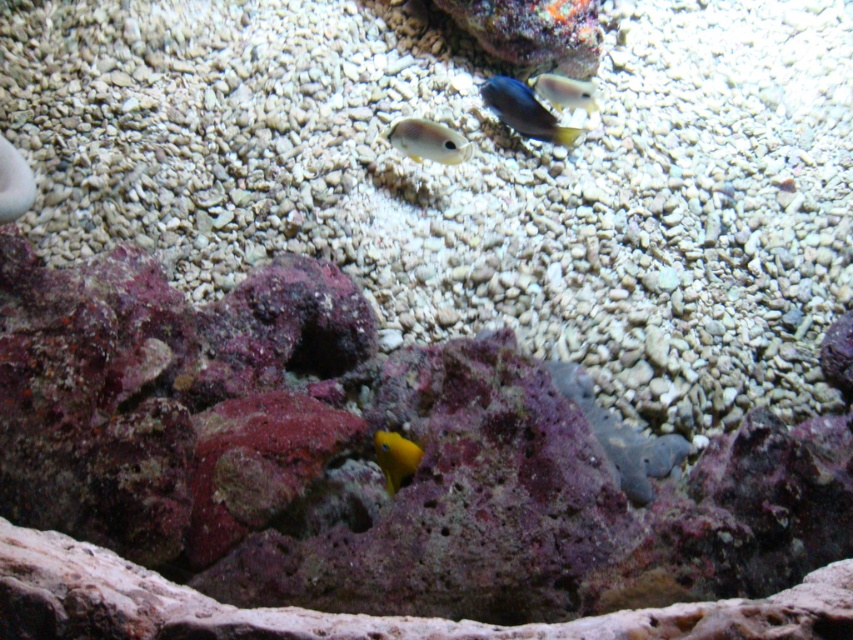
You are a diver exploring the underwater scene. You notice a yellow matte fish at center. Can you estimate its position relative to the center of the image?

The yellow matte fish at center is located at 2D coordinates approximately 0.716 along the x axis and 0.464 along the y axis.

You are an underwater photographer aiming to capture a closeup of both the blue glossy fish at center and the yellow matte fish at center. Given that your camera can only focus on one fish at a time, which fish should you adjust the focus for first if you want to ensure the larger fish is in focus first?

The blue glossy fish at center is larger in width than the yellow matte fish at center, so you should focus on the blue glossy fish at center first.